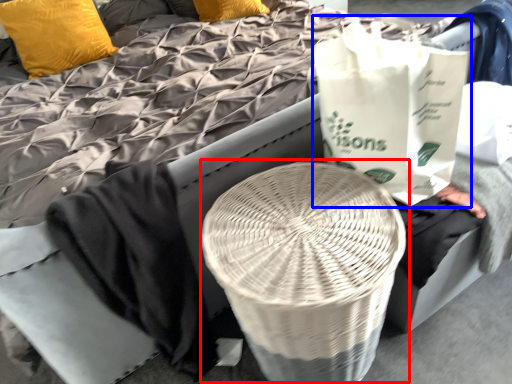
Question: Which point is further to the camera, round table (highlighted by a red box) or grocery bag (highlighted by a blue box)?

Choices:
 (A) round table
 (B) grocery bag

Answer: (B)